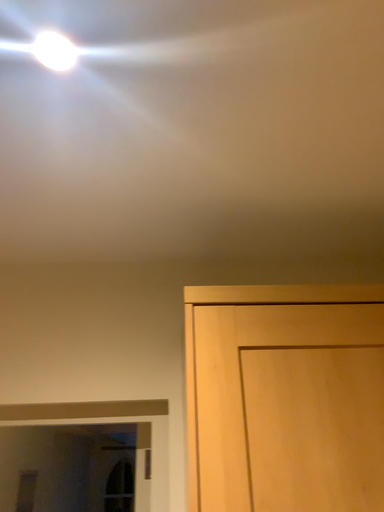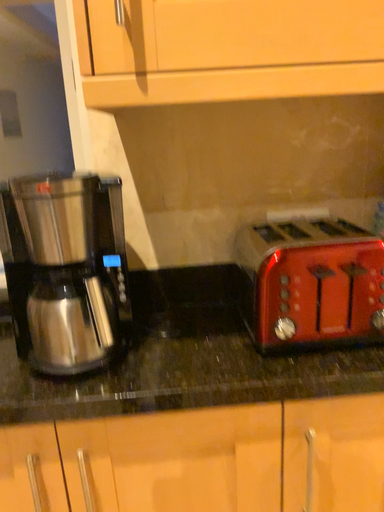
Question: How did the camera likely rotate when shooting the video?

Choices:
 (A) rotated downward
 (B) rotated upward

Answer: (A)